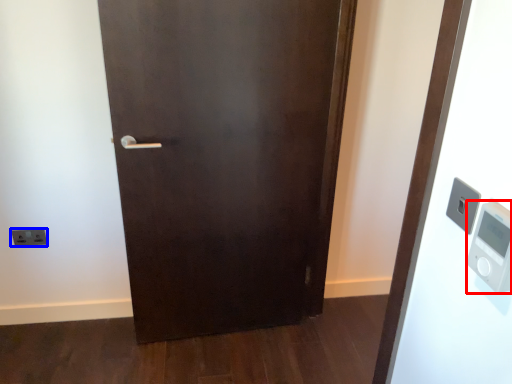
Question: Which object is closer to the camera taking this photo, thermometer (highlighted by a red box) or light switch (highlighted by a blue box)?

Choices:
 (A) thermometer
 (B) light switch

Answer: (A)